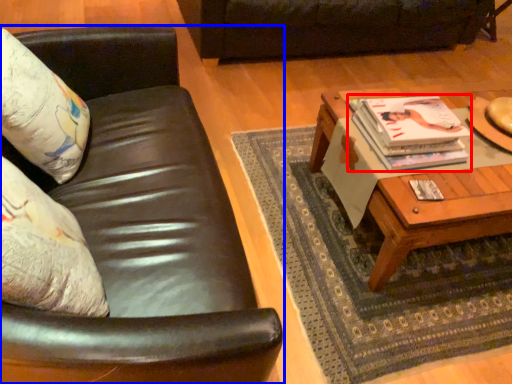
Question: Among these objects, which one is farthest to the camera, magazine (highlighted by a red box) or studio couch (highlighted by a blue box)?

Choices:
 (A) magazine
 (B) studio couch

Answer: (A)